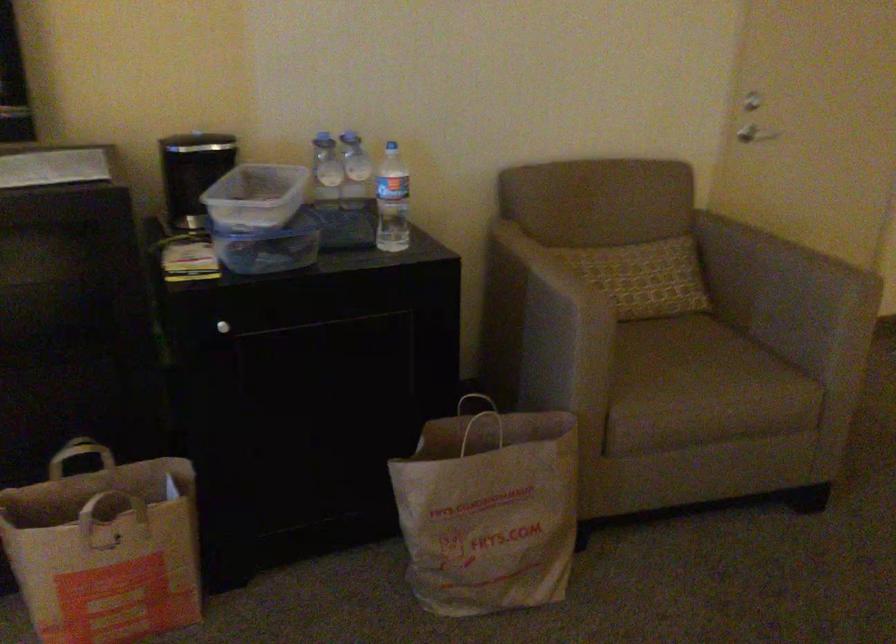
What do you see at coordinates (760, 135) in the screenshot?
I see `the metal door handle` at bounding box center [760, 135].